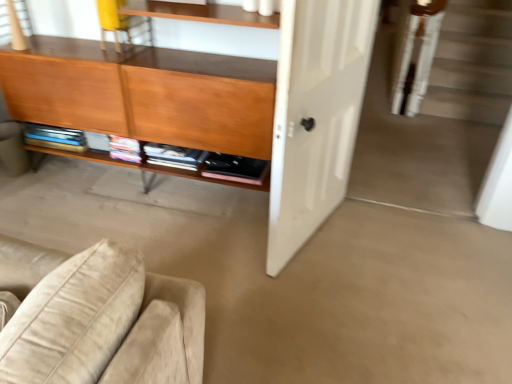
Question: Considering the relative positions of matte wood cabinet at left and white matte door at center in the image provided, is matte wood cabinet at left in front of white matte door at center?

Choices:
 (A) yes
 (B) no

Answer: (B)

Question: Considering the relative sizes of matte wood cabinet at left and white matte door at center in the image provided, is matte wood cabinet at left thinner than white matte door at center?

Choices:
 (A) no
 (B) yes

Answer: (A)

Question: Can you confirm if matte wood cabinet at left is smaller than white matte door at center?

Choices:
 (A) no
 (B) yes

Answer: (A)

Question: From a real-world perspective, is matte wood cabinet at left physically below white matte door at center?

Choices:
 (A) no
 (B) yes

Answer: (A)

Question: From a real-world perspective, is matte wood cabinet at left positioned over white matte door at center based on gravity?

Choices:
 (A) yes
 (B) no

Answer: (A)

Question: Is matte wood cabinet at left to the left or to the right of yellow fabric chair at upper left in the image?

Choices:
 (A) left
 (B) right

Answer: (B)

Question: In the image, is matte wood cabinet at left positioned in front of or behind yellow fabric chair at upper left?

Choices:
 (A) front
 (B) behind

Answer: (A)

Question: Is matte wood cabinet at left bigger or smaller than yellow fabric chair at upper left?

Choices:
 (A) small
 (B) big

Answer: (B)

Question: From their relative heights in the image, would you say matte wood cabinet at left is taller or shorter than yellow fabric chair at upper left?

Choices:
 (A) short
 (B) tall

Answer: (B)

Question: Visually, is matte wood cabinet at left positioned to the left or to the right of white matte door at center?

Choices:
 (A) left
 (B) right

Answer: (A)

Question: Considering the positions of point (192, 82) and point (282, 92), is point (192, 82) closer or farther from the camera than point (282, 92)?

Choices:
 (A) farther
 (B) closer

Answer: (A)

Question: Looking at their shapes, would you say matte wood cabinet at left is wider or thinner than white matte door at center?

Choices:
 (A) wide
 (B) thin

Answer: (A)

Question: Is matte wood cabinet at left spatially inside white matte door at center, or outside of it?

Choices:
 (A) outside
 (B) inside

Answer: (A)

Question: Considering the positions of white matte door at center and matte wood cabinet at left in the image, is white matte door at center wider or thinner than matte wood cabinet at left?

Choices:
 (A) wide
 (B) thin

Answer: (B)

Question: In terms of height, does white matte door at center look taller or shorter compared to matte wood cabinet at left?

Choices:
 (A) tall
 (B) short

Answer: (A)